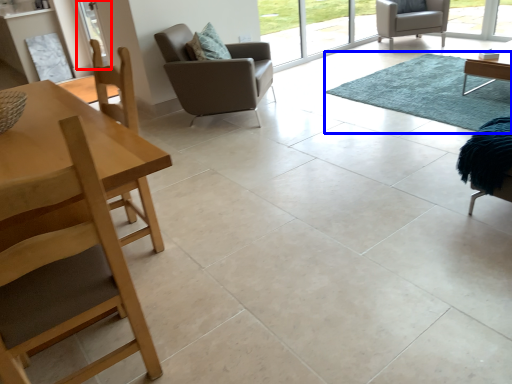
Question: Which of the following is the farthest to the observer, screen door (highlighted by a red box) or mat (highlighted by a blue box)?

Choices:
 (A) screen door
 (B) mat

Answer: (A)